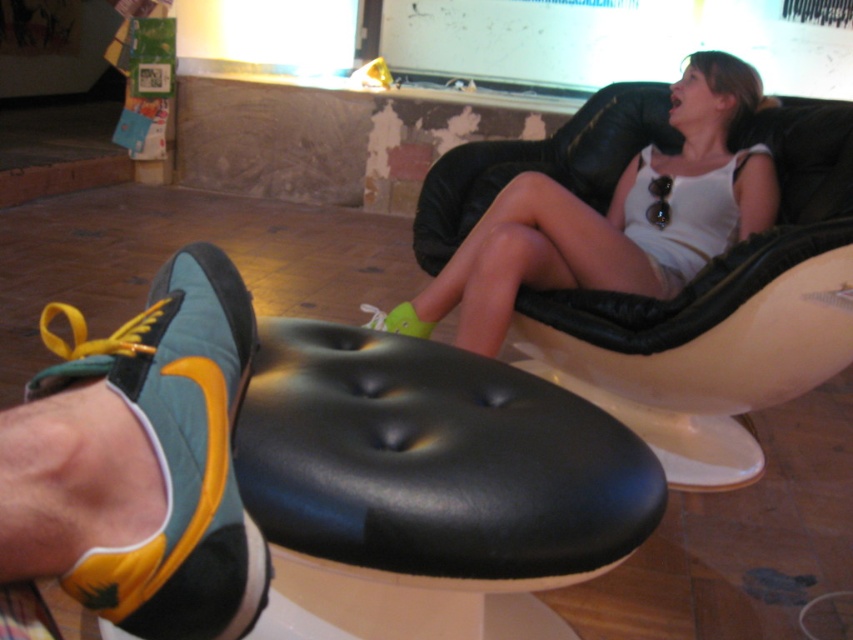
Between green suede shoe at lower left and green suede shoe at lower center, which one has less height?

green suede shoe at lower center

Is green suede shoe at lower left shorter than green suede shoe at lower center?

Incorrect, green suede shoe at lower left's height does not fall short of green suede shoe at lower center's.

Where is `green suede shoe at lower left`? Image resolution: width=853 pixels, height=640 pixels. green suede shoe at lower left is located at coordinates [x=177, y=452].

Can you confirm if green suede shoe at lower left is positioned to the left of white matte tank top at upper center?

Yes, green suede shoe at lower left is to the left of white matte tank top at upper center.

The height and width of the screenshot is (640, 853). Find the location of `green suede shoe at lower left`. green suede shoe at lower left is located at coordinates (177, 452).

Between black leather footrest at lower center and white matte tank top at upper center, which one is positioned lower?

Positioned lower is black leather footrest at lower center.

Between black leather footrest at lower center and white matte tank top at upper center, which one appears on the right side from the viewer's perspective?

white matte tank top at upper center is more to the right.

Who is more distant from viewer, (x=287, y=358) or (x=718, y=152)?

The point (x=718, y=152) is more distant.

The image size is (853, 640). Identify the location of black leather footrest at lower center. (431, 476).